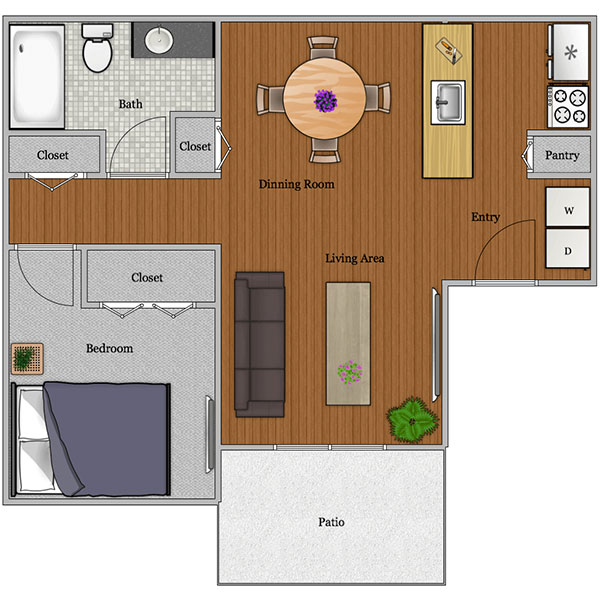
The image size is (600, 600). What are the coordinates of `places to sit` in the screenshot? It's located at (272, 388), (267, 347), (266, 305), (323, 147), (273, 98), (319, 51), (375, 100), (98, 57).